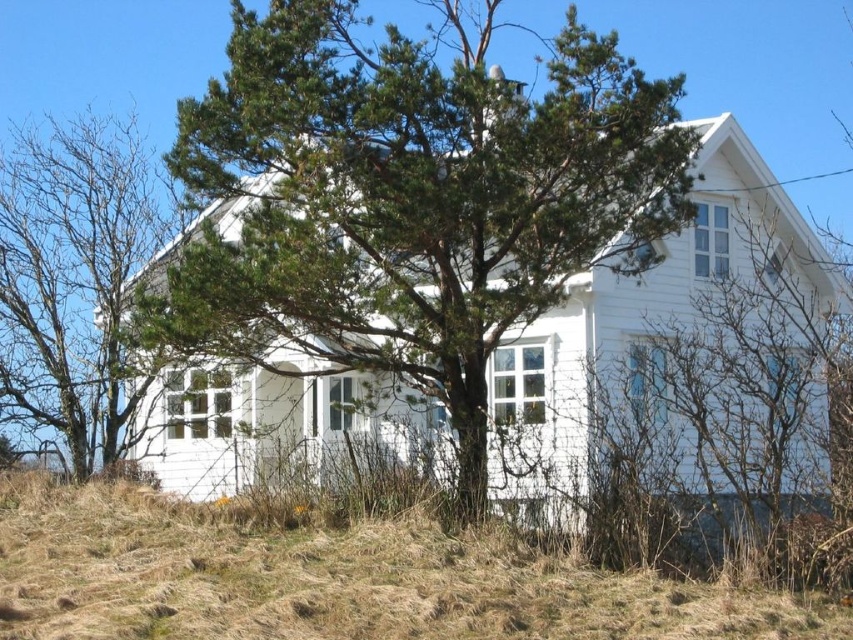
In the scene shown: Who is positioned more to the right, green needle-like tree at center or green leafy tree at left?

From the viewer's perspective, green needle-like tree at center appears more on the right side.

Between green needle-like tree at center and green leafy tree at left, which one appears on the left side from the viewer's perspective?

Positioned to the left is green leafy tree at left.

Is point (575, 60) farther from viewer compared to point (65, 180)?

No, it is in front of (65, 180).

In order to click on green needle-like tree at center in this screenshot , I will do `click(409, 200)`.

Does point (296, 548) come farther from viewer compared to point (96, 356)?

No, it is not.

Does dry grass at lower left have a smaller size compared to green leafy tree at left?

Yes, dry grass at lower left is smaller than green leafy tree at left.

Between point (428, 538) and point (119, 291), which one is positioned behind?

Positioned behind is point (119, 291).

Where is `dry grass at lower left`? dry grass at lower left is located at coordinates (335, 580).

Between green needle-like tree at center and dry grass at lower left, which one has more height?

green needle-like tree at center

Does point (357, 250) lie in front of point (253, 540)?

No.

Does point (234, 100) come farther from viewer compared to point (167, 566)?

Yes.

Where is `green needle-like tree at center`? The width and height of the screenshot is (853, 640). green needle-like tree at center is located at coordinates (409, 200).